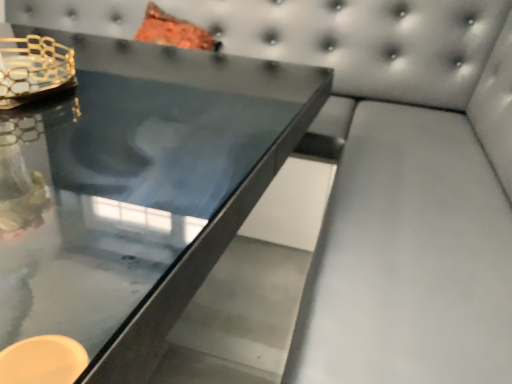
Question: Considering the positions of glossy glass table at center and gold mesh candle holder at upper left in the image, is glossy glass table at center taller or shorter than gold mesh candle holder at upper left?

Choices:
 (A) tall
 (B) short

Answer: (A)

Question: Is point (x=261, y=160) closer or farther from the camera than point (x=20, y=56)?

Choices:
 (A) closer
 (B) farther

Answer: (A)

Question: In the image, is glossy glass table at center positioned in front of or behind gold mesh candle holder at upper left?

Choices:
 (A) front
 (B) behind

Answer: (A)

Question: Considering the relative positions of gold mesh candle holder at upper left and glossy glass table at center in the image provided, is gold mesh candle holder at upper left to the left or to the right of glossy glass table at center?

Choices:
 (A) left
 (B) right

Answer: (A)

Question: Considering the positions of gold mesh candle holder at upper left and glossy glass table at center in the image, is gold mesh candle holder at upper left wider or thinner than glossy glass table at center?

Choices:
 (A) wide
 (B) thin

Answer: (B)

Question: From a real-world perspective, relative to glossy glass table at center, is gold mesh candle holder at upper left vertically above or below?

Choices:
 (A) above
 (B) below

Answer: (A)

Question: Relative to glossy glass table at center, is gold mesh candle holder at upper left in front or behind?

Choices:
 (A) behind
 (B) front

Answer: (A)